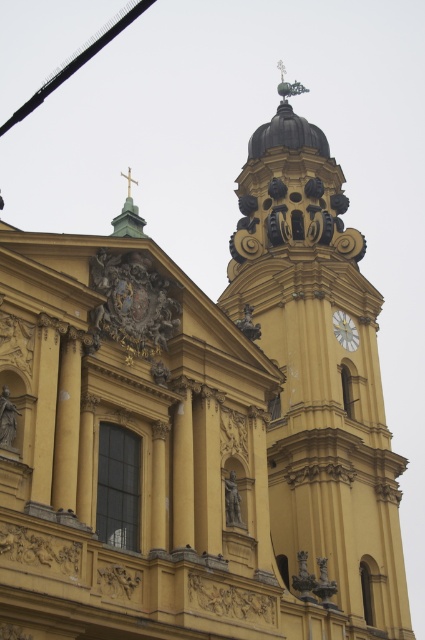
You are an architect evaluating the proportions of the building. Given the presence of the yellow matte tower at upper right and the white marble clock at upper center, which object would you say occupies a greater area in the image?

The yellow matte tower at upper right is larger in size than the white marble clock at upper center, so it occupies a greater area in the image.

From the picture: You are standing in front of the grand building and want to take a photo of both the yellow matte tower at upper right and the white marble clock at upper center. If you tilt your camera upwards, which object will appear higher in the photo?

The white marble clock at upper center will appear higher in the photo because the yellow matte tower at upper right is closer to the viewer, making it appear lower relative to the more distant white marble clock at upper center.